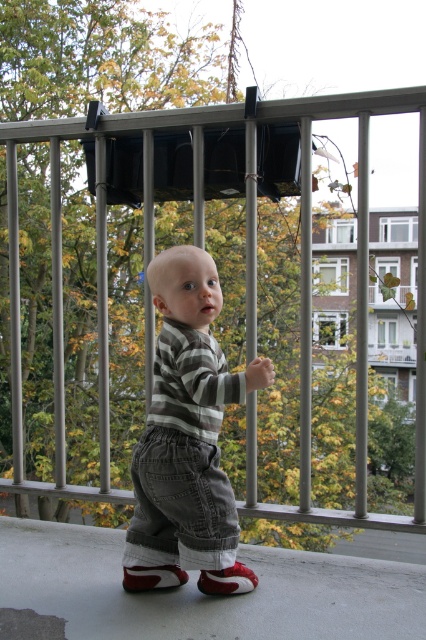
Question: Which point is farther to the camera?

Choices:
 (A) white leather sneaker at center
 (B) smooth concrete ledge at center
 (C) striped cotton shirt at center

Answer: (A)

Question: Which object is positioned closest to the red suede sneaker at center?

Choices:
 (A) smooth concrete ledge at center
 (B) striped cotton shirt at center

Answer: (A)

Question: Which point is farther to the camera?

Choices:
 (A) (253, 588)
 (B) (307, 609)
 (C) (192, 429)

Answer: (A)

Question: Does smooth concrete ledge at center come behind striped cotton shirt at center?

Choices:
 (A) no
 (B) yes

Answer: (A)

Question: Does smooth concrete ledge at center have a greater width compared to white leather sneaker at center?

Choices:
 (A) yes
 (B) no

Answer: (A)

Question: Does smooth concrete ledge at center have a greater width compared to red suede sneaker at center?

Choices:
 (A) no
 (B) yes

Answer: (B)